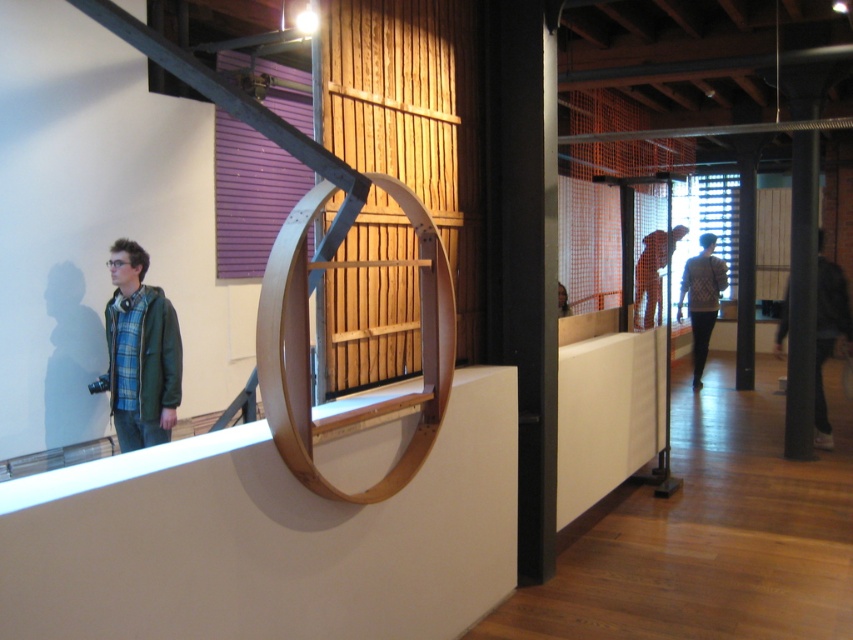
Question: Does dark brown leather jacket at center right have a greater width compared to orange fabric at center?

Choices:
 (A) yes
 (B) no

Answer: (B)

Question: Is knit sweater at center to the right of orange fabric at center from the viewer's perspective?

Choices:
 (A) yes
 (B) no

Answer: (A)

Question: Observing the image, what is the correct spatial positioning of knit sweater at center in reference to orange fabric at center?

Choices:
 (A) below
 (B) above

Answer: (A)

Question: Which point is farther from the camera taking this photo?

Choices:
 (A) click(708, 252)
 (B) click(639, 260)

Answer: (A)

Question: Which is nearer to the orange fabric at center?

Choices:
 (A) dark brown leather jacket at center right
 (B) green matte jacket at left
 (C) knit sweater at center

Answer: (C)

Question: Among these points, which one is farthest from the camera?

Choices:
 (A) (815, 349)
 (B) (718, 292)

Answer: (B)